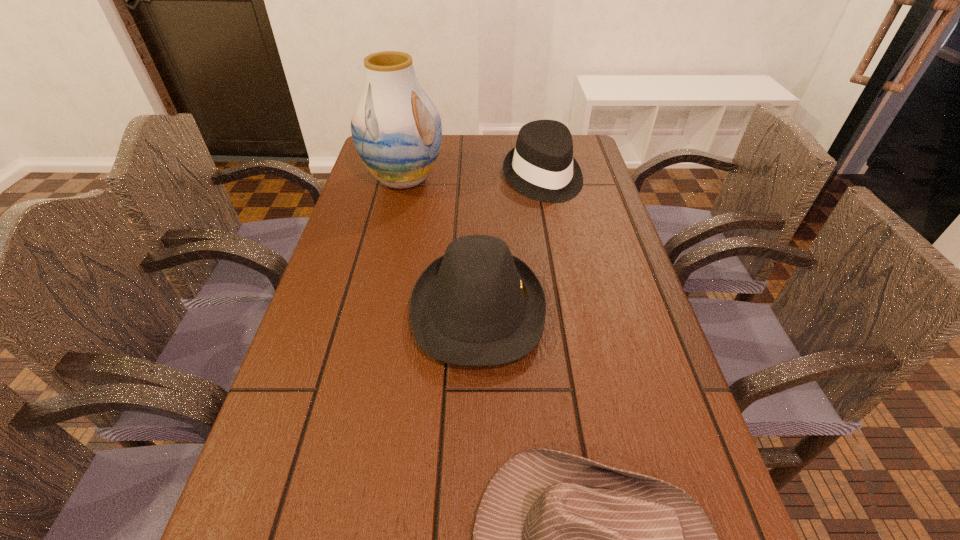
Locate an element on the screen. This screenshot has height=540, width=960. object situated at the far left corner is located at coordinates (396, 129).

This screenshot has width=960, height=540. Identify the location of object present at the far right corner. pyautogui.click(x=541, y=166).

Where is `vacant position at the far edge of the desktop`? This screenshot has height=540, width=960. vacant position at the far edge of the desktop is located at coordinates (483, 138).

Locate an element on the screen. vacant space at the left edge of the desktop is located at coordinates (272, 451).

This screenshot has width=960, height=540. I want to click on empty location between the third farthest object and the farthest fedora, so click(511, 244).

You are a GUI agent. You are given a task and a screenshot of the screen. Output one action in this format:
    pyautogui.click(x=<x>, y=<y>)
    Task: Click on the vacant area that lies between the farthest fedora and the second nearest object
    
    Given the screenshot: What is the action you would take?
    [x=511, y=244]

I want to click on free space between the second nearest fedora and the vase, so click(441, 245).

Identify which object is the nearest to the tallest object. Please provide its 2D coordinates. Your answer should be formatted as a tuple, i.e. [(x, y)], where the tuple contains the x and y coordinates of a point satisfying the conditions above.

[(541, 166)]

You are a GUI agent. You are given a task and a screenshot of the screen. Output one action in this format:
    pyautogui.click(x=<x>, y=<y>)
    Task: Click on the closest object to the second nearest fedora
    
    Given the screenshot: What is the action you would take?
    [x=559, y=539]

The height and width of the screenshot is (540, 960). Identify the location of the closest fedora to the second farthest fedora. (559, 539).